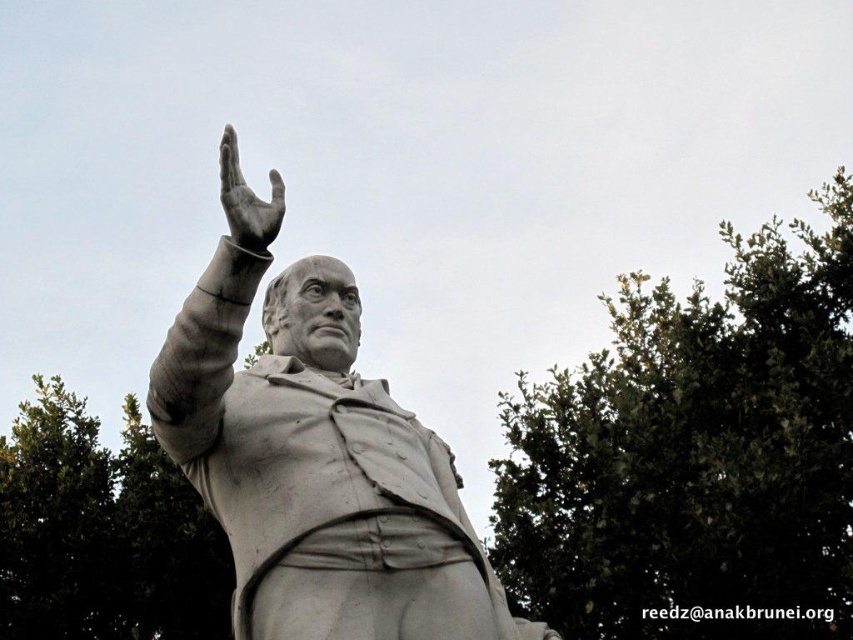
Based on the photo, you are standing in front of a statue and want to take a photo of it. The statue is the white marble statue at center. Your camera has a maximum focus range of 20 meters. Will you be able to focus on the statue?

The white marble statue at center is 19.57 meters away from you. Since your camera can focus up to 20 meters, you can focus on the statue.

You are an art conservator assessing the statue. You notice the white marble statue at center and the polished bronze hand at upper center. Which object is located to the right of the other?

The white marble statue at center is positioned on the right side of polished bronze hand at upper center.

Consider the image. You are standing in front of the statue and want to place two markers at the specified points. Which point, point (437, 611) or point (270, 180), is closer to you?

Point (437, 611) is in front of point (270, 180), so it is closer to you.